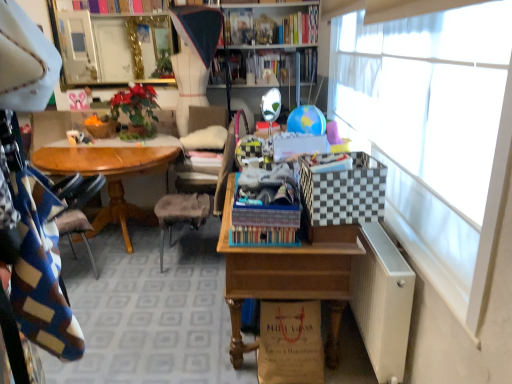
Where is `black and white checkered picnic basket at right`? This screenshot has width=512, height=384. black and white checkered picnic basket at right is located at coordinates (343, 191).

The height and width of the screenshot is (384, 512). I want to click on brown fabric chair at center, so click(x=180, y=214).

What do you see at coordinates (228, 67) in the screenshot? I see `hardcover book at upper center, arranged as the second book when viewed from the right` at bounding box center [228, 67].

The image size is (512, 384). What are the coordinates of `white sheer curtain at right` in the screenshot? It's located at (435, 134).

Image resolution: width=512 pixels, height=384 pixels. What do you see at coordinates (383, 302) in the screenshot?
I see `white metallic radiator at lower right` at bounding box center [383, 302].

The height and width of the screenshot is (384, 512). Find the location of `green leafy plant at center`. green leafy plant at center is located at coordinates (136, 110).

Where is `hardcover books at upper center, which is the second book in bottom-to-top order`? hardcover books at upper center, which is the second book in bottom-to-top order is located at coordinates tap(300, 27).

What do you see at coordinates (300, 27) in the screenshot? I see `hardcover books at upper center, acting as the 2th book starting from the left` at bounding box center [300, 27].

What are the coordinates of `black and white checkered picnic basket at right` in the screenshot? It's located at (343, 191).

Is brown fabric chair at center outside of green leafy plant at center?

Yes, brown fabric chair at center is located beyond the bounds of green leafy plant at center.

Based on their positions, is brown fabric chair at center located to the left or right of green leafy plant at center?

brown fabric chair at center is positioned on green leafy plant at center's right side.

Considering the sizes of objects brown fabric chair at center and green leafy plant at center in the image provided, who is smaller, brown fabric chair at center or green leafy plant at center?

green leafy plant at center is smaller.

Looking at their sizes, would you say green leafy plant at center is wider or thinner than wooden desk at center?

Clearly, green leafy plant at center has less width compared to wooden desk at center.

Is green leafy plant at center positioned with its back to wooden desk at center?

No, wooden desk at center is not at the back of green leafy plant at center.

From the image's perspective, would you say green leafy plant at center is shown under wooden desk at center?

No, from the image's perspective, green leafy plant at center is not beneath wooden desk at center.

Is point (141, 129) in front of point (258, 278)?

No, (141, 129) is behind (258, 278).

From a real-world perspective, is brown fabric chair at center under white sheer curtain at right?

Yes.

Which object is closer to the camera, brown fabric chair at center or white sheer curtain at right?

white sheer curtain at right is in front.

Is white sheer curtain at right facing towards brown fabric chair at center?

No.

From a real-world perspective, is white sheer curtain at right below brown fabric chair at center?

No, from a real-world perspective, white sheer curtain at right is not under brown fabric chair at center.

Does point (510, 110) come farther from viewer compared to point (231, 136)?

That is False.

Visually, is white sheer curtain at right positioned to the left or to the right of brown fabric chair at center?

In the image, white sheer curtain at right appears on the right side of brown fabric chair at center.

From a real-world perspective, which is physically above, hardcover books at upper center, the first book from the right, or burlap flowerpot at center?

From a 3D spatial view, hardcover books at upper center, the first book from the right, is above.

In the image, there is a hardcover books at upper center, acting as the 2th book starting from the left. In order to click on flowerpot below it (from the image's perspective) in this screenshot , I will do `click(102, 129)`.

Can you confirm if hardcover books at upper center, which is the 1th book from top to bottom, is shorter than burlap flowerpot at center?

No, hardcover books at upper center, which is the 1th book from top to bottom, is not shorter than burlap flowerpot at center.

Consider the image. Is hardcover books at upper center, which is the second book in bottom-to-top order, touching burlap flowerpot at center?

They are not placed beside each other.

Considering the positions of objects burlap flowerpot at center and hardcover book at upper center, arranged as the second book when viewed from the right, in the image provided, who is in front, burlap flowerpot at center or hardcover book at upper center, arranged as the second book when viewed from the right,?

burlap flowerpot at center is in front.

The height and width of the screenshot is (384, 512). Find the location of `flowerpot in front of the hardcover book at upper center, arranged as the second book when viewed from the top`. flowerpot in front of the hardcover book at upper center, arranged as the second book when viewed from the top is located at coordinates (102, 129).

Is burlap flowerpot at center inside or outside of black and white checkered picnic basket at right?

burlap flowerpot at center is not inside black and white checkered picnic basket at right, it's outside.

From the image's perspective, between burlap flowerpot at center and black and white checkered picnic basket at right, who is located below?

black and white checkered picnic basket at right.

Which is more to the right, burlap flowerpot at center or black and white checkered picnic basket at right?

black and white checkered picnic basket at right.

Locate an element on the screen. This screenshot has height=384, width=512. chair below the green leafy plant at center (from the image's perspective) is located at coordinates (180, 214).

Find the location of a particular element. The image size is (512, 384). desk in front of the green leafy plant at center is located at coordinates (289, 276).

Considering their positions, is burlap flowerpot at center positioned further to white metallic radiator at lower right than green leafy plant at center?

The object further to white metallic radiator at lower right is burlap flowerpot at center.

When comparing their distances from hardcover book at upper center, the first book in the left-to-right sequence, does black and white checkered picnic basket at right or white metallic radiator at lower right seem further?

The object further to hardcover book at upper center, the first book in the left-to-right sequence, is white metallic radiator at lower right.

Based on their spatial positions, is black and white checkered picnic basket at right or burlap flowerpot at center further from white sheer curtain at right?

burlap flowerpot at center is positioned further to the anchor white sheer curtain at right.

Considering their positions, is black and white checkered picnic basket at right positioned closer to hardcover books at upper center, which is the 1th book from top to bottom, than white sheer curtain at right?

Based on the image, white sheer curtain at right appears to be nearer to hardcover books at upper center, which is the 1th book from top to bottom.

Which object lies nearer to the anchor point hardcover book at upper center, the first book in the left-to-right sequence, brown fabric chair at center or white metallic radiator at lower right?

Based on the image, brown fabric chair at center appears to be nearer to hardcover book at upper center, the first book in the left-to-right sequence.

From the image, which object appears to be farther from green leafy plant at center, hardcover books at upper center, which is the second book in bottom-to-top order, or hardcover book at upper center, arranged as the second book when viewed from the right?

hardcover books at upper center, which is the second book in bottom-to-top order.

Considering their positions, is burlap flowerpot at center positioned closer to brown fabric chair at center than white metallic radiator at lower right?

burlap flowerpot at center.

Based on their spatial positions, is burlap flowerpot at center or white metallic radiator at lower right closer to hardcover book at upper center, the first book in the left-to-right sequence?

Based on the image, burlap flowerpot at center appears to be nearer to hardcover book at upper center, the first book in the left-to-right sequence.

The height and width of the screenshot is (384, 512). I want to click on chair located between white metallic radiator at lower right and burlap flowerpot at center in the depth direction, so click(x=180, y=214).

Image resolution: width=512 pixels, height=384 pixels. In order to click on file cabinet between white sheer curtain at right and hardcover book at upper center, arranged as the second book when viewed from the right, from front to back in this screenshot , I will do `click(383, 302)`.

Find the location of a particular element. picnic basket between white sheer curtain at right and wooden desk at center along the z-axis is located at coordinates (343, 191).

Where is `houseplant positioned between black and white checkered picnic basket at right and burlap flowerpot at center from near to far`? houseplant positioned between black and white checkered picnic basket at right and burlap flowerpot at center from near to far is located at coordinates (136, 110).